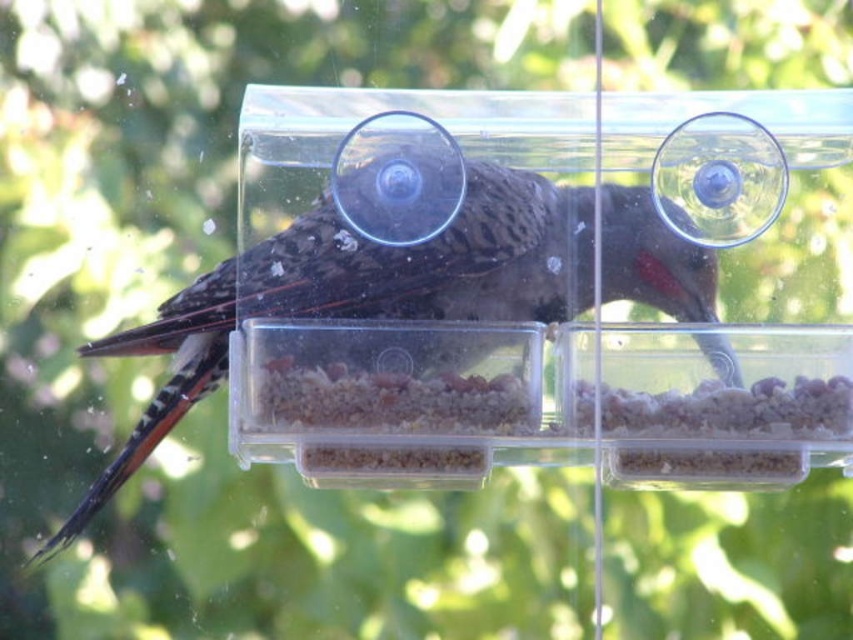
Looking at this image, you are standing at a distance from the bird feeder and want to know if you can reach the point marked as point (199, 291) on the feeder with a 20 inch long pole. Can you do it?

The distance between point (199, 291) and the viewer is 23.72 inches. Since the pole is only 20 inches long, you cannot reach the point with the pole.

You are a birdwatcher trying to determine the position of two points on a Northern Flicker bird. The points are labeled as point (198, 280) and point (639, 413). Based on the image, which point is closer to the viewer?

Point (639, 413) is closer to the viewer because point (198, 280) is behind it.

You are a bird watching the brown grainy seeds at center and the white granular food at lower right in the feeder. Which food is positioned more to the left side?

The brown grainy seeds at center is positioned more to the left side than the white granular food at lower right.